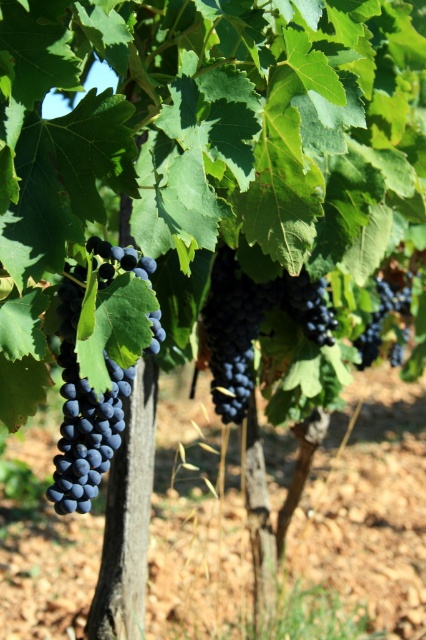
Is shiny dark blue grapes at center-left below dark matte grapes at center?

Yes.

Consider the image. Who is higher up, shiny dark blue grapes at center-left or dark matte grapes at center?

Positioned higher is dark matte grapes at center.

Find the location of a particular element. Image resolution: width=426 pixels, height=640 pixels. shiny dark blue grapes at center-left is located at coordinates (83, 410).

Identify the location of shiny dark blue grapes at center-left. The image size is (426, 640). (83, 410).

Is shiny dark blue grapes at center-left smaller than shiny dark purple grapes at center?

Indeed, shiny dark blue grapes at center-left has a smaller size compared to shiny dark purple grapes at center.

Is shiny dark blue grapes at center-left positioned before shiny dark purple grapes at center?

That is True.

Between point (92, 433) and point (233, 285), which one is positioned behind?

The point (233, 285) is more distant.

This screenshot has width=426, height=640. Find the location of `shiny dark blue grapes at center-left`. shiny dark blue grapes at center-left is located at coordinates (83, 410).

From the picture: Can you confirm if shiny dark purple grapes at center is taller than dark matte grapes at center?

Indeed, shiny dark purple grapes at center has a greater height compared to dark matte grapes at center.

Who is shorter, shiny dark purple grapes at center or dark matte grapes at center?

dark matte grapes at center

Identify the location of shiny dark purple grapes at center. (253, 324).

At what (x,y) coordinates should I click in order to perform the action: click on shiny dark purple grapes at center. Please return your answer as a coordinate pair (x, y). Looking at the image, I should click on (253, 324).